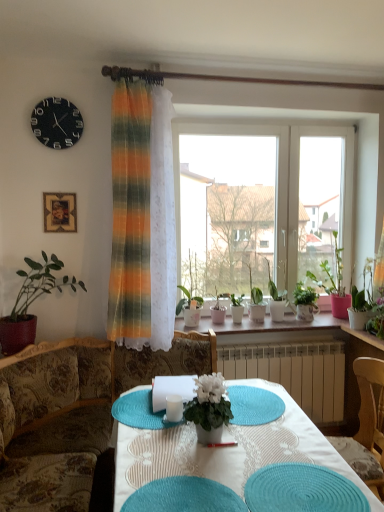
Locate an element on the screen. The height and width of the screenshot is (512, 384). vacant space to the left of white matte flower pot at center, the fourth houseplant viewed from the right is located at coordinates tap(168, 439).